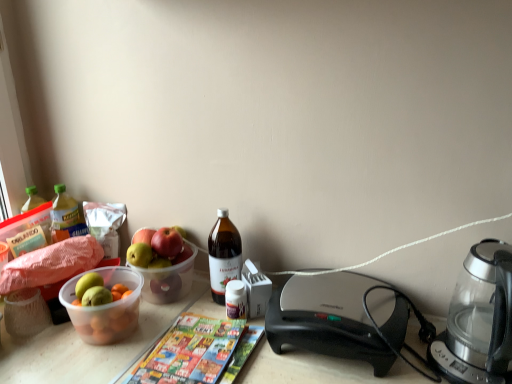
Question: Does translucent plastic bottle at left, the second bottle viewed from the front, have a lesser width compared to translucent glass bottle at center, positioned as the 2th bottle in left-to-right order?

Choices:
 (A) no
 (B) yes

Answer: (B)

Question: Does translucent plastic bottle at left, the first bottle from the back, have a larger size compared to translucent glass bottle at center, the first bottle viewed from the front?

Choices:
 (A) no
 (B) yes

Answer: (A)

Question: Is translucent plastic bottle at left, positioned as the 1th bottle in left-to-right order, far away from translucent glass bottle at center, positioned as the 2th bottle in left-to-right order?

Choices:
 (A) no
 (B) yes

Answer: (A)

Question: Considering the relative sizes of translucent plastic bottle at left, the first bottle from the back, and translucent glass bottle at center, positioned as the 2th bottle in left-to-right order, in the image provided, is translucent plastic bottle at left, the first bottle from the back, shorter than translucent glass bottle at center, positioned as the 2th bottle in left-to-right order,?

Choices:
 (A) no
 (B) yes

Answer: (B)

Question: Considering the relative positions of translucent plastic bottle at left, the 2th bottle positioned from the right, and translucent glass bottle at center, which is the first bottle in right-to-left order, in the image provided, is translucent plastic bottle at left, the 2th bottle positioned from the right, behind translucent glass bottle at center, which is the first bottle in right-to-left order,?

Choices:
 (A) yes
 (B) no

Answer: (A)

Question: Is multicolored glossy magazine at center wider or thinner than transparent glass coffee maker at right?

Choices:
 (A) wide
 (B) thin

Answer: (A)

Question: From the image's perspective, is multicolored glossy magazine at center positioned above or below transparent glass coffee maker at right?

Choices:
 (A) above
 (B) below

Answer: (B)

Question: Is multicolored glossy magazine at center in front of or behind transparent glass coffee maker at right in the image?

Choices:
 (A) front
 (B) behind

Answer: (B)

Question: Choose the correct answer: Is multicolored glossy magazine at center inside transparent glass coffee maker at right or outside it?

Choices:
 (A) inside
 (B) outside

Answer: (B)

Question: Looking at their shapes, would you say black plastic sandwich maker at center is wider or thinner than multicolored glossy magazine at center?

Choices:
 (A) thin
 (B) wide

Answer: (B)

Question: Is black plastic sandwich maker at center taller or shorter than multicolored glossy magazine at center?

Choices:
 (A) short
 (B) tall

Answer: (B)

Question: Which is correct: black plastic sandwich maker at center is inside multicolored glossy magazine at center, or outside of it?

Choices:
 (A) inside
 (B) outside

Answer: (B)

Question: Visually, is black plastic sandwich maker at center positioned to the left or to the right of multicolored glossy magazine at center?

Choices:
 (A) right
 (B) left

Answer: (A)

Question: Based on their positions, is transparent glass coffee maker at right located to the left or right of multicolored glossy magazine at center?

Choices:
 (A) right
 (B) left

Answer: (A)

Question: Is transparent glass coffee maker at right in front of or behind multicolored glossy magazine at center in the image?

Choices:
 (A) front
 (B) behind

Answer: (A)